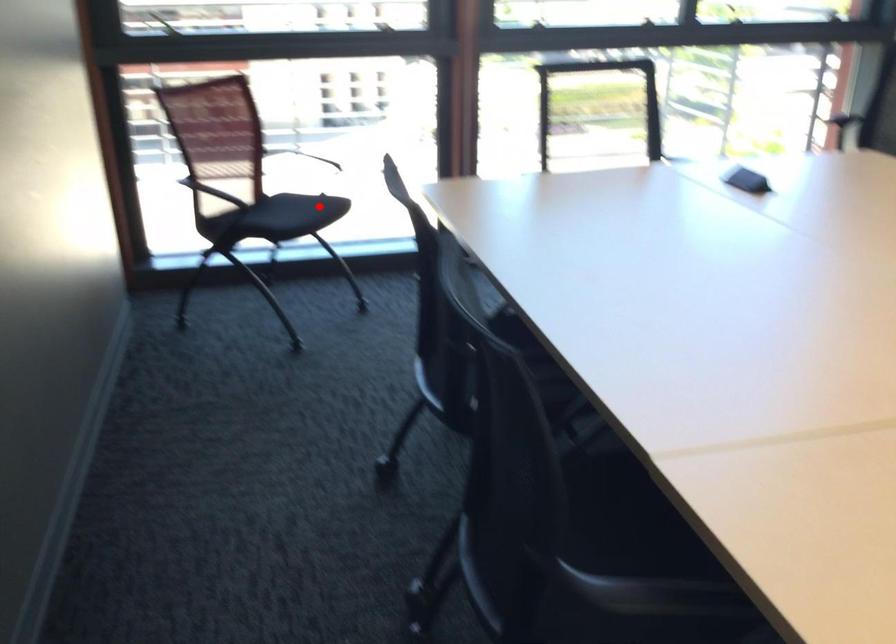
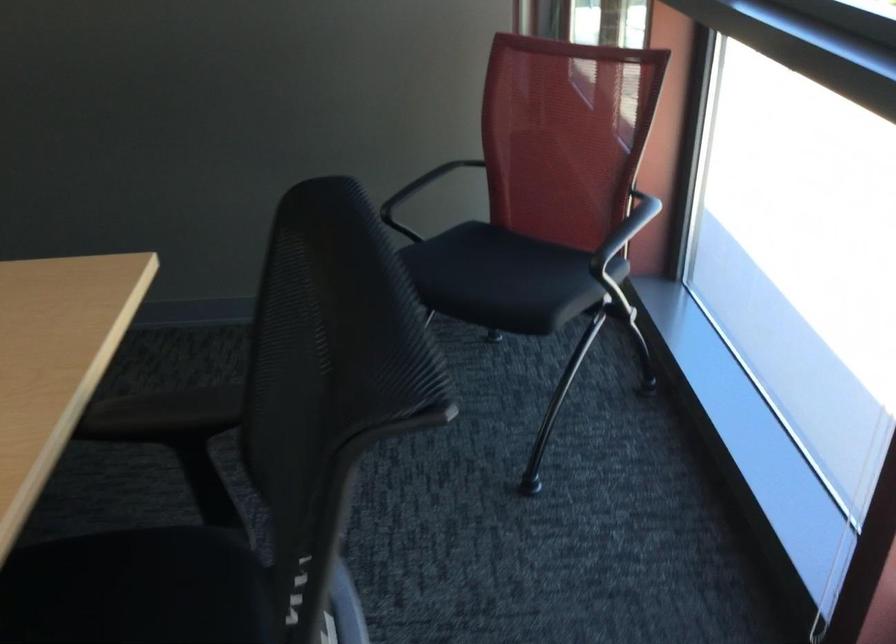
The point at the highlighted location is marked in the first image. Where is the corresponding point in the second image?

(493, 277)